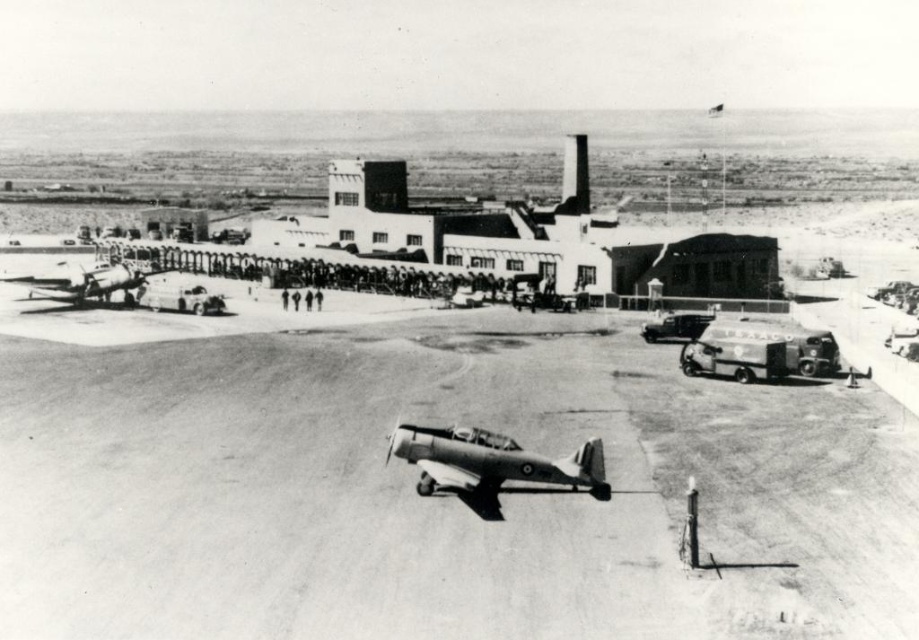
You are a ground crew member at the airfield. You need to move a 50 meter long equipment truck from the metallic gray airplane at center to the metallic silver airplane at left. Is there enough space between them to maneuver the truck?

The metallic gray airplane at center and metallic silver airplane at left are 53.52 meters apart from each other. Since the equipment truck is 50 meters long, there is sufficient space to maneuver it between them.

You are a pilot preparing to board your aircraft. You notice the smooth asphalt tarmac at center and the metallic silver airplane at left. Which object is taller from your perspective?

The metallic silver airplane at left is taller than the smooth asphalt tarmac at center.

You are a maintenance crew member at the airfield and need to inspect both the metallic gray airplane at center and the metallic silver airplane at left. Which airplane do you need to look down more to inspect from your standing position?

You need to look down more to inspect the metallic gray airplane at center because it has a lesser height compared to the metallic silver airplane at left.